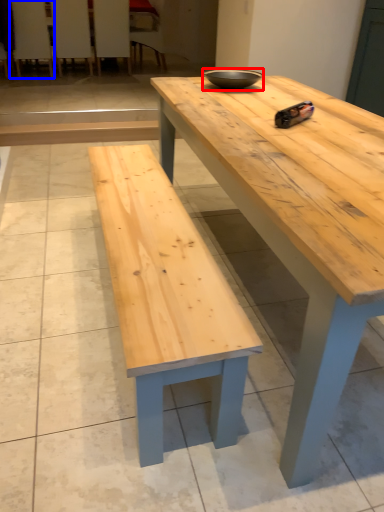
Question: Which of the following is the closest to the observer, bowl (highlighted by a red box) or chair (highlighted by a blue box)?

Choices:
 (A) bowl
 (B) chair

Answer: (A)